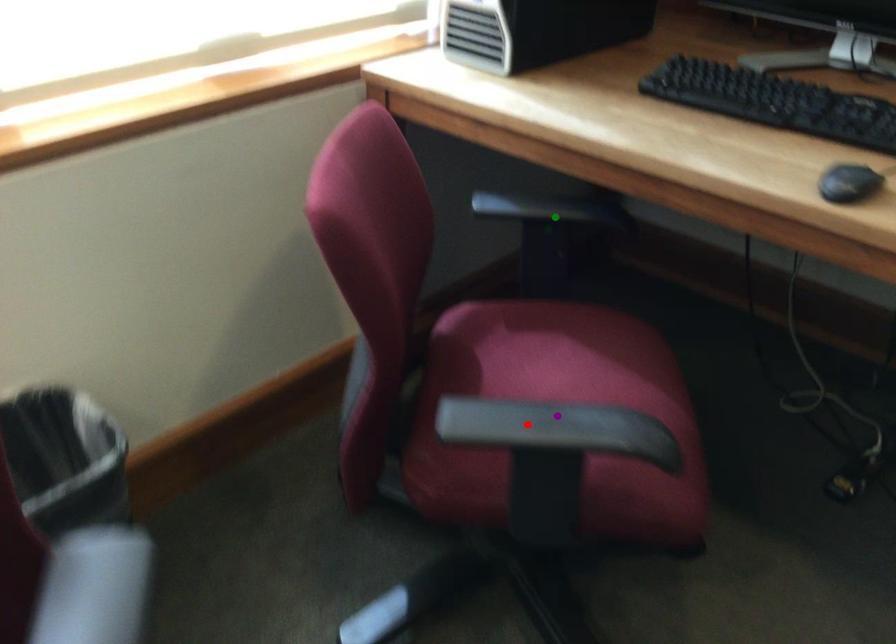
Order these from nearest to farthest:
A) green point
B) purple point
C) red point

green point, purple point, red point